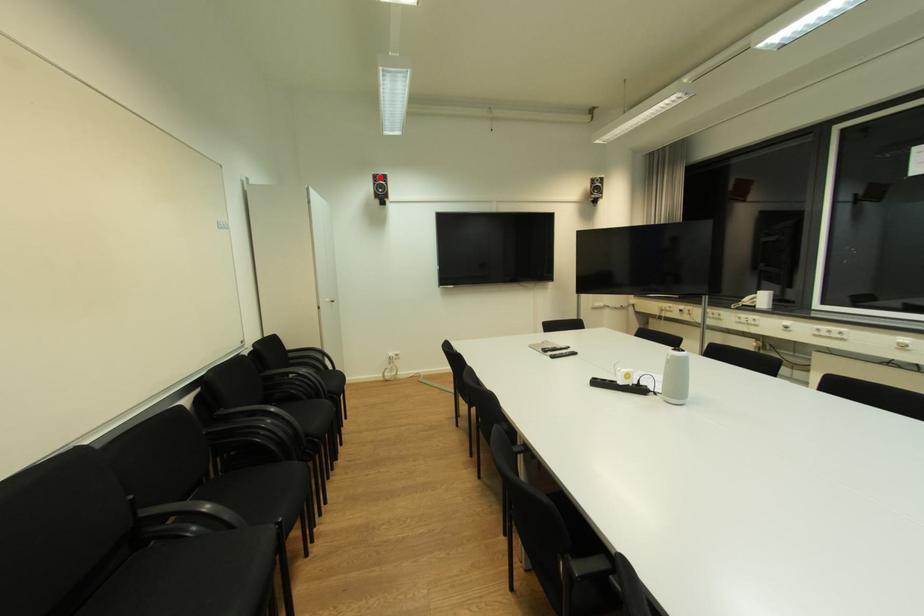
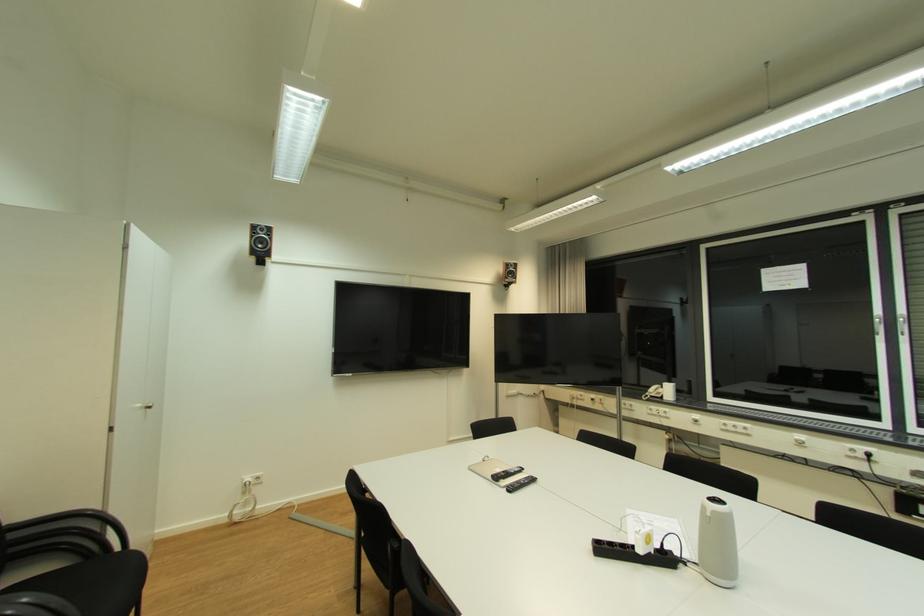
Locate, in the second image, the point that corresponds to the highlighted location in the first image.

(261, 228)